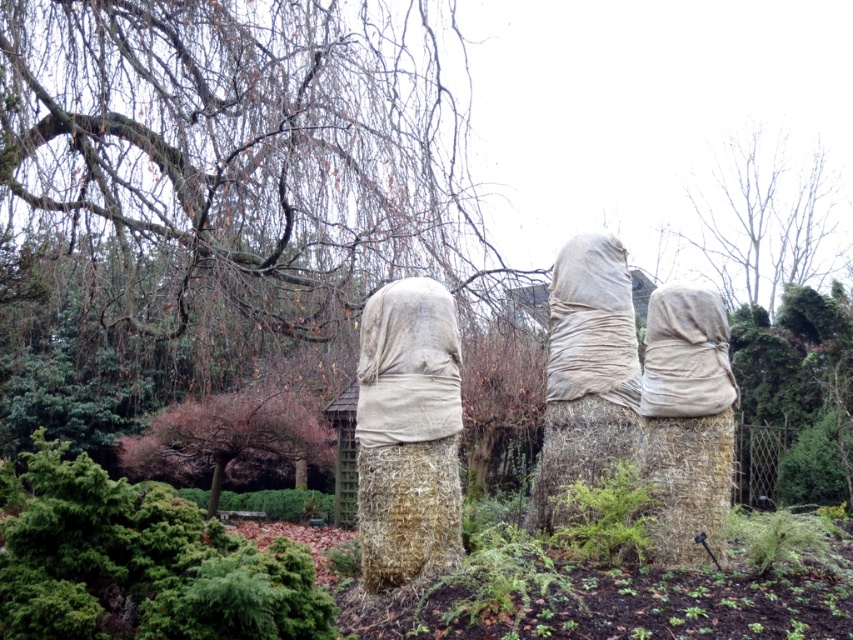
Is brown mossy tree trunk at upper left below matte beige fabric at center?

No, brown mossy tree trunk at upper left is not below matte beige fabric at center.

Does brown mossy tree trunk at upper left have a greater height compared to matte beige fabric at center?

Yes.

Who is more forward, (x=282, y=42) or (x=558, y=289)?

Point (x=558, y=289) is in front.

Locate an element on the screen. This screenshot has height=640, width=853. brown mossy tree trunk at upper left is located at coordinates (247, 147).

Does burlap-covered figure at center appear on the left side of bare branches at upper center?

Indeed, burlap-covered figure at center is positioned on the left side of bare branches at upper center.

Does burlap-covered figure at center have a lesser width compared to bare branches at upper center?

Yes, burlap-covered figure at center is thinner than bare branches at upper center.

Describe the element at coordinates (408, 433) in the screenshot. This screenshot has height=640, width=853. I see `burlap-covered figure at center` at that location.

The image size is (853, 640). What are the coordinates of `burlap-covered figure at center` in the screenshot? It's located at (408, 433).

Is the position of brown mossy tree trunk at upper left less distant than that of bare branches at upper center?

Yes, it is.

From the picture: Who is shorter, brown mossy tree trunk at upper left or bare branches at upper center?

With less height is bare branches at upper center.

Is point (350, 205) behind point (776, 296)?

No, it is not.

At what (x,y) coordinates should I click in order to perform the action: click on brown mossy tree trunk at upper left. Please return your answer as a coordinate pair (x, y). Looking at the image, I should click on pos(247,147).